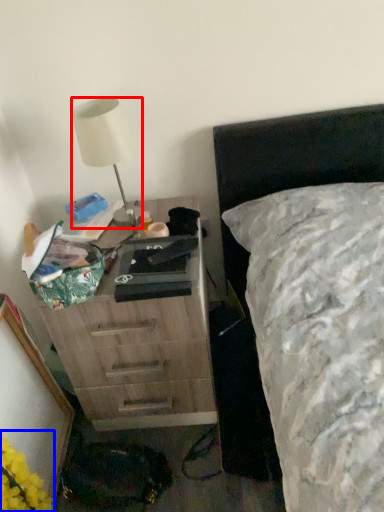
Question: Which object is further to the camera taking this photo, lamp (highlighted by a red box) or flower (highlighted by a blue box)?

Choices:
 (A) lamp
 (B) flower

Answer: (A)